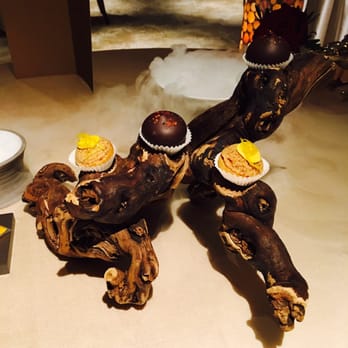
Where is `table`? The height and width of the screenshot is (348, 348). table is located at coordinates (186, 295).